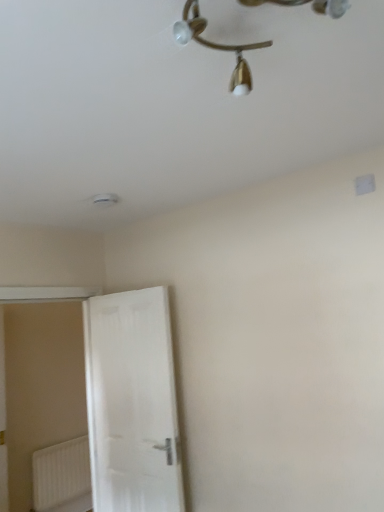
Question: Relative to gold metallic chandelier at upper center, is white matte door at left in front or behind?

Choices:
 (A) behind
 (B) front

Answer: (A)

Question: In terms of width, does white matte door at left look wider or thinner when compared to gold metallic chandelier at upper center?

Choices:
 (A) thin
 (B) wide

Answer: (A)

Question: Which of these objects is positioned farthest from the white matte door at left?

Choices:
 (A) white plastic radiator at lower left
 (B) gold metallic chandelier at upper center

Answer: (B)

Question: Estimate the real-world distances between objects in this image. Which object is closer to the white plastic radiator at lower left?

Choices:
 (A) white matte door at left
 (B) gold metallic chandelier at upper center

Answer: (A)